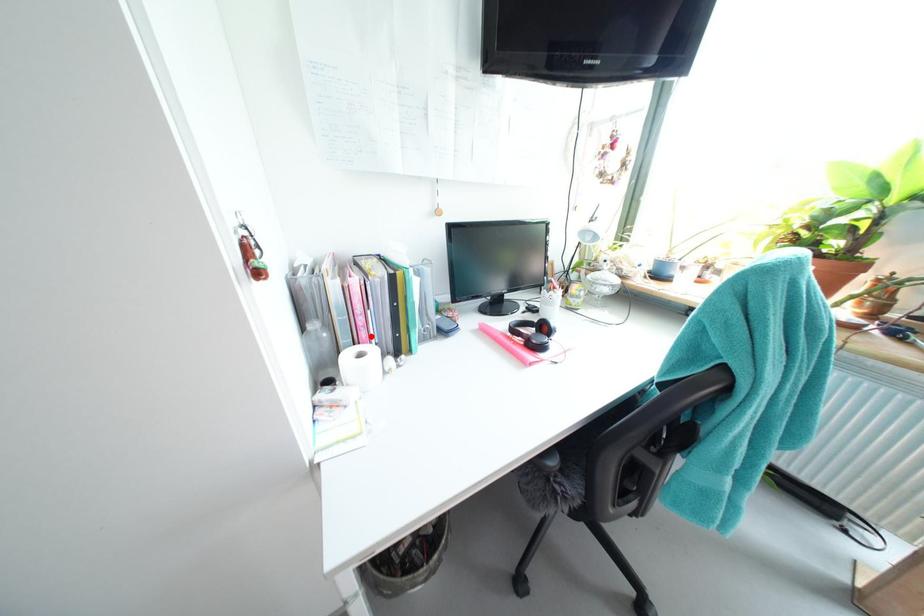
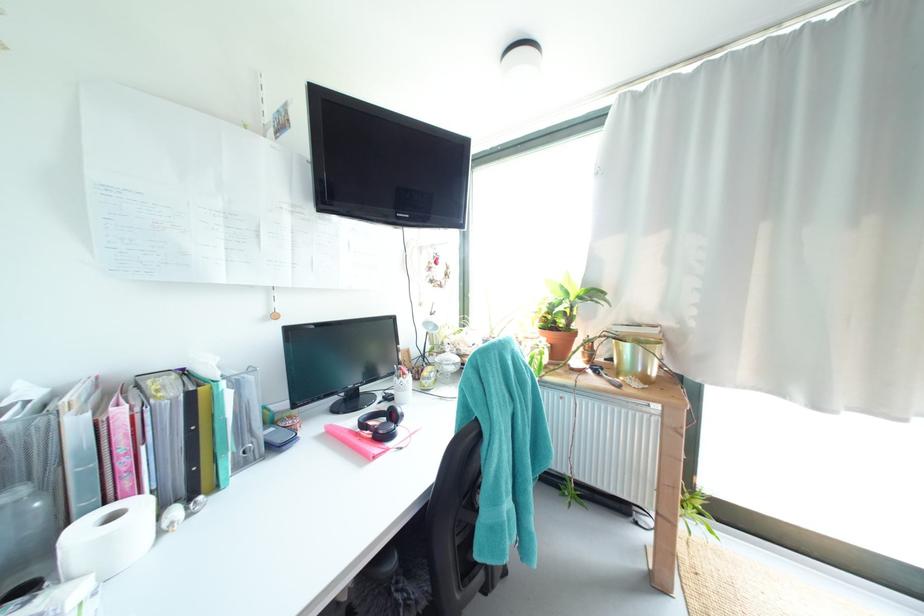
Where in the second image is the point corresponding to the highlighted location from the first image?

(135, 485)